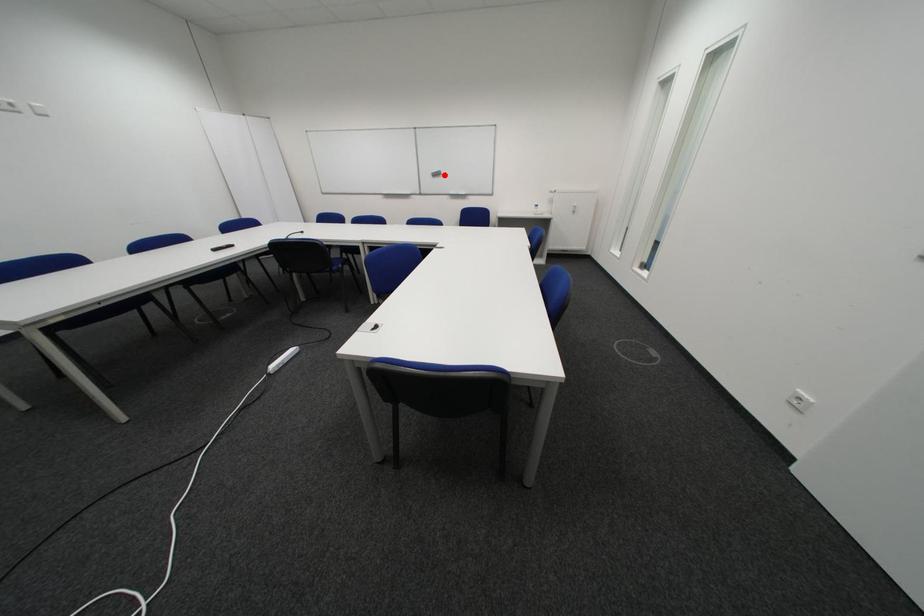
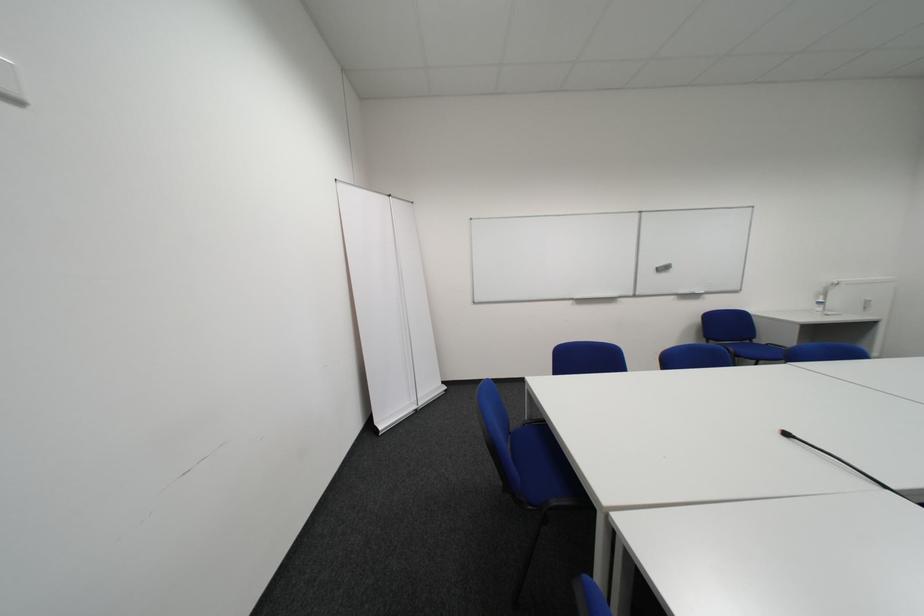
Question: I am providing you with two images of the same scene from different viewpoints. Given a red point in image1, look at the same physical point in image2. Is it:

Choices:
 (A) Closer to the viewpoint
 (B) Farther from the viewpoint

Answer: (B)